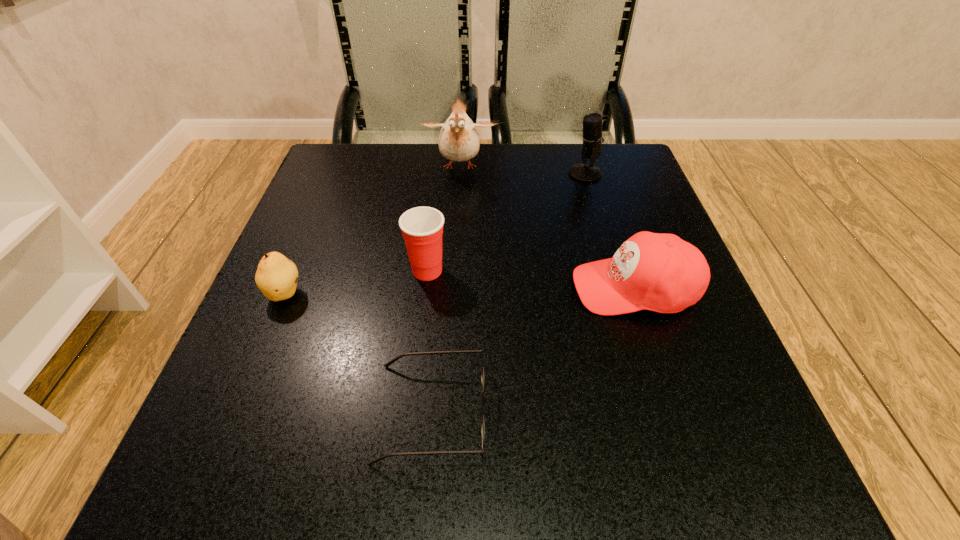
The height and width of the screenshot is (540, 960). Find the location of `free space between the bird and the baseball cap`. free space between the bird and the baseball cap is located at coordinates (547, 228).

Find the location of a particular element. free space between the Dixie cup and the shortest object is located at coordinates (429, 341).

The height and width of the screenshot is (540, 960). In order to click on free space that is in between the leftmost object and the Dixie cup in this screenshot , I will do `click(356, 282)`.

You are a GUI agent. You are given a task and a screenshot of the screen. Output one action in this format:
    pyautogui.click(x=<x>, y=<y>)
    Task: Click on the vacant point located between the Dixie cup and the leftmost object
    The width and height of the screenshot is (960, 540).
    Given the screenshot: What is the action you would take?
    pyautogui.click(x=356, y=282)

You are a GUI agent. You are given a task and a screenshot of the screen. Output one action in this format:
    pyautogui.click(x=<x>, y=<y>)
    Task: Click on the free space between the baseball cap and the microphone
    
    Given the screenshot: What is the action you would take?
    pyautogui.click(x=610, y=231)

Identify the location of empty space between the bird and the nearest object. (445, 290).

Identify the location of unoccupied area between the bird and the baseball cap. (547, 228).

The image size is (960, 540). I want to click on the fourth closest object to the bird, so click(276, 276).

What are the coordinates of `object that is the fifth closest to the Dixie cup` in the screenshot? It's located at (592, 137).

Where is `blank space that satisfies the following two spatial constraints: 1. at the beak of the bird; 2. on the left side of the microphone`? Image resolution: width=960 pixels, height=540 pixels. blank space that satisfies the following two spatial constraints: 1. at the beak of the bird; 2. on the left side of the microphone is located at coordinates (460, 174).